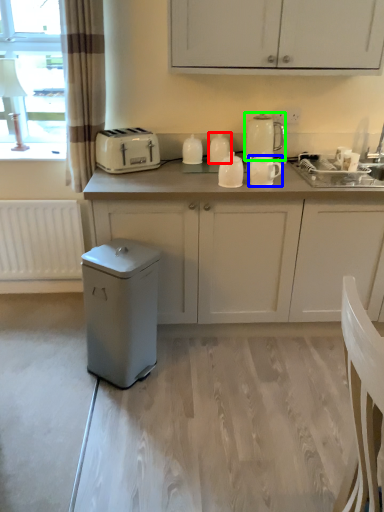
Question: Which is farther away from kitchen appliance (highlighted by a red box)? kitchen appliance (highlighted by a blue box) or kitchen appliance (highlighted by a green box)?

Choices:
 (A) kitchen appliance
 (B) kitchen appliance

Answer: (A)